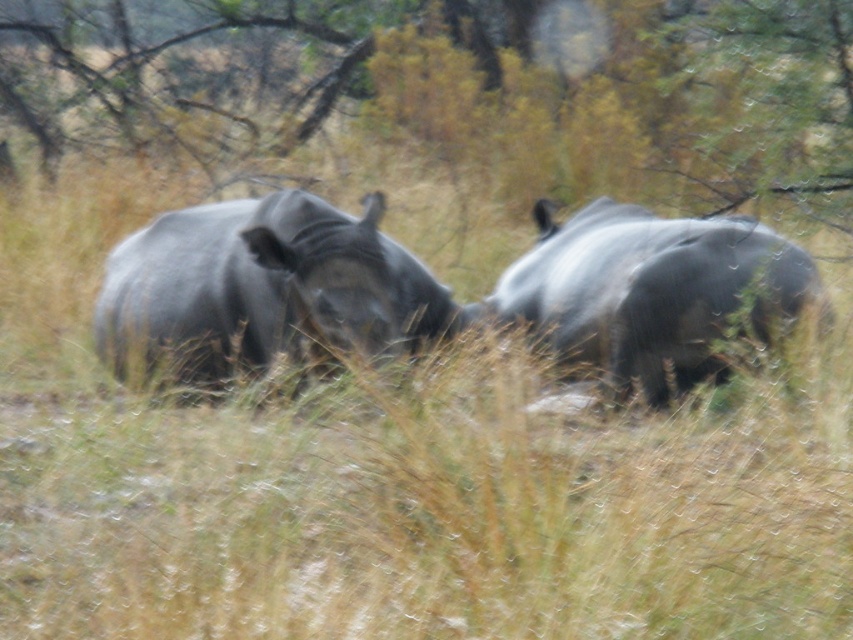
Between brown textured tree at upper center and gray matte rhinoceros at right, which one appears on the right side from the viewer's perspective?

From the viewer's perspective, gray matte rhinoceros at right appears more on the right side.

Is point (701, 65) positioned behind point (553, 250)?

Yes, point (701, 65) is behind point (553, 250).

At what (x,y) coordinates should I click in order to perform the action: click on brown textured tree at upper center. Please return your answer as a coordinate pair (x, y). This screenshot has height=640, width=853. Looking at the image, I should click on (457, 86).

Is point (108, 74) positioned in front of point (250, 227)?

No, it is not.

This screenshot has width=853, height=640. What do you see at coordinates (457, 86) in the screenshot? I see `brown textured tree at upper center` at bounding box center [457, 86].

Find the location of `brown textured tree at upper center`. brown textured tree at upper center is located at coordinates (457, 86).

Can you confirm if smooth gray rhino at center is positioned to the left of gray matte rhinoceros at right?

Correct, you'll find smooth gray rhino at center to the left of gray matte rhinoceros at right.

Who is shorter, smooth gray rhino at center or gray matte rhinoceros at right?

smooth gray rhino at center is shorter.

Locate an element on the screen. smooth gray rhino at center is located at coordinates (260, 288).

Locate an element on the screen. This screenshot has width=853, height=640. smooth gray rhino at center is located at coordinates (260, 288).